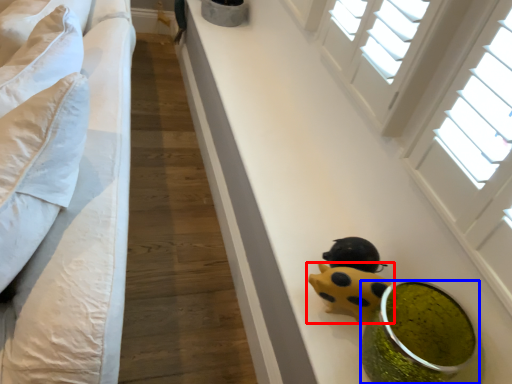
Question: Which object appears closest to the camera in this image, toy (highlighted by a red box) or food (highlighted by a blue box)?

Choices:
 (A) toy
 (B) food

Answer: (B)